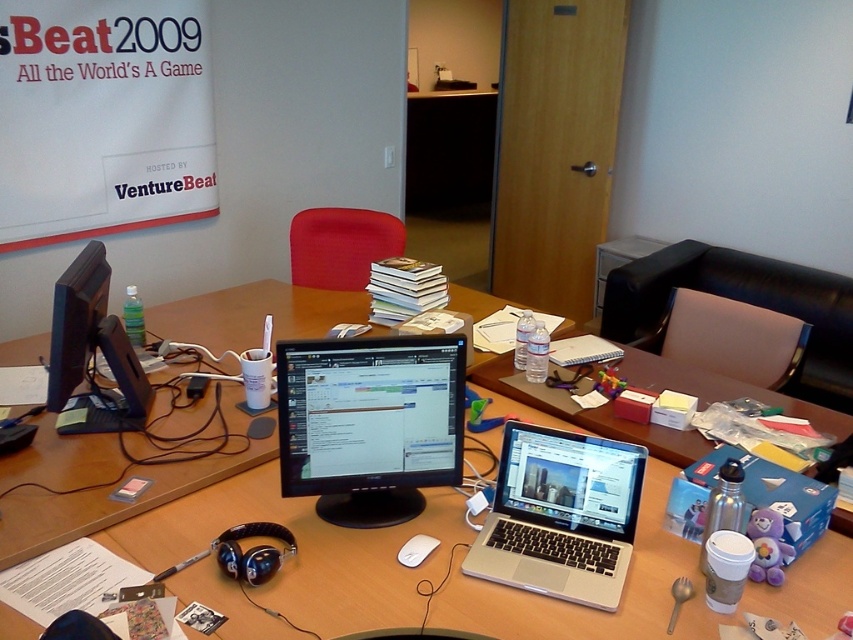
Who is higher up, white paperboard at upper left or black glossy monitor at left?

white paperboard at upper left

Is white paperboard at upper left bigger than black glossy monitor at left?

Yes.

Where is `white paperboard at upper left`? white paperboard at upper left is located at coordinates (102, 116).

Does wooden table at center have a greater width compared to black glossy monitor at center?

Correct, the width of wooden table at center exceeds that of black glossy monitor at center.

Measure the distance between wooden table at center and black glossy monitor at center.

The distance of wooden table at center from black glossy monitor at center is 13.57 inches.

The width and height of the screenshot is (853, 640). In order to click on wooden table at center in this screenshot , I will do [x=242, y=522].

Between point (419, 493) and point (538, 532), which one is positioned in front?

Positioned in front is point (538, 532).

This screenshot has width=853, height=640. Identify the location of black glossy monitor at center. (369, 422).